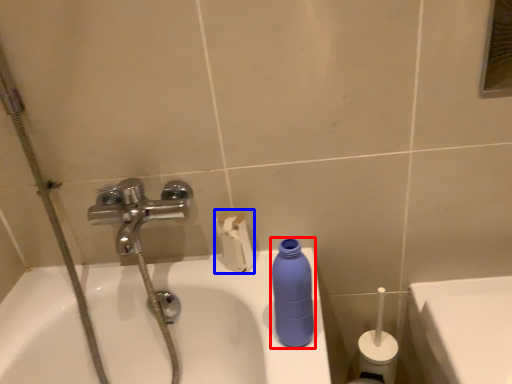
Question: Which object appears farthest to the camera in this image, cleaning product (highlighted by a red box) or toilet paper (highlighted by a blue box)?

Choices:
 (A) cleaning product
 (B) toilet paper

Answer: (B)